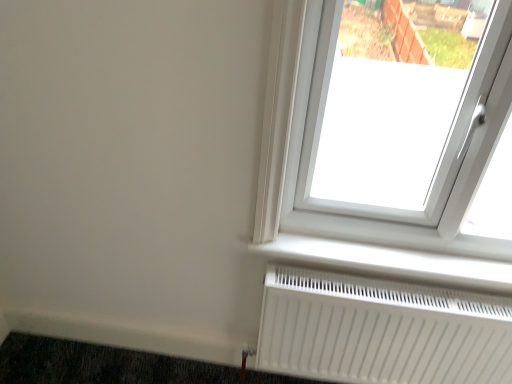
Question: Based on their sizes in the image, would you say dark gray carpet at lower left is bigger or smaller than white plastic radiator at lower center?

Choices:
 (A) small
 (B) big

Answer: (B)

Question: From the image's perspective, is dark gray carpet at lower left above or below white plastic radiator at lower center?

Choices:
 (A) below
 (B) above

Answer: (A)

Question: Which of these objects is positioned farthest from the white matte radiator at lower right?

Choices:
 (A) dark gray carpet at lower left
 (B) white plastic radiator at lower center

Answer: (A)

Question: Which of these objects is positioned closest to the dark gray carpet at lower left?

Choices:
 (A) white plastic radiator at lower center
 (B) white matte radiator at lower right

Answer: (B)